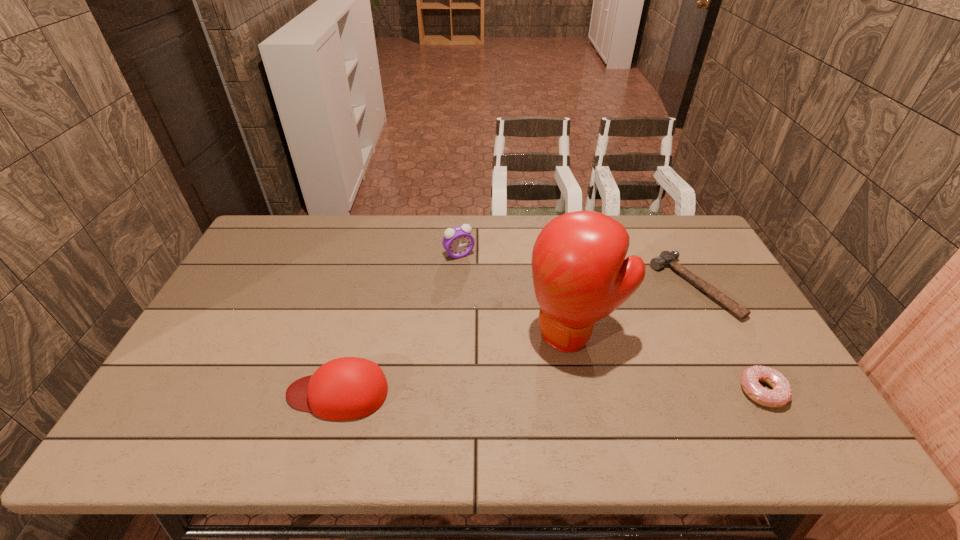
The image size is (960, 540). In order to click on the second closest object to the second object from left to right in this screenshot , I will do `click(347, 388)`.

Locate which object is the closest to the leftmost object. Please provide its 2D coordinates. Your answer should be formatted as a tuple, i.e. [(x, y)], where the tuple contains the x and y coordinates of a point satisfying the conditions above.

[(580, 276)]